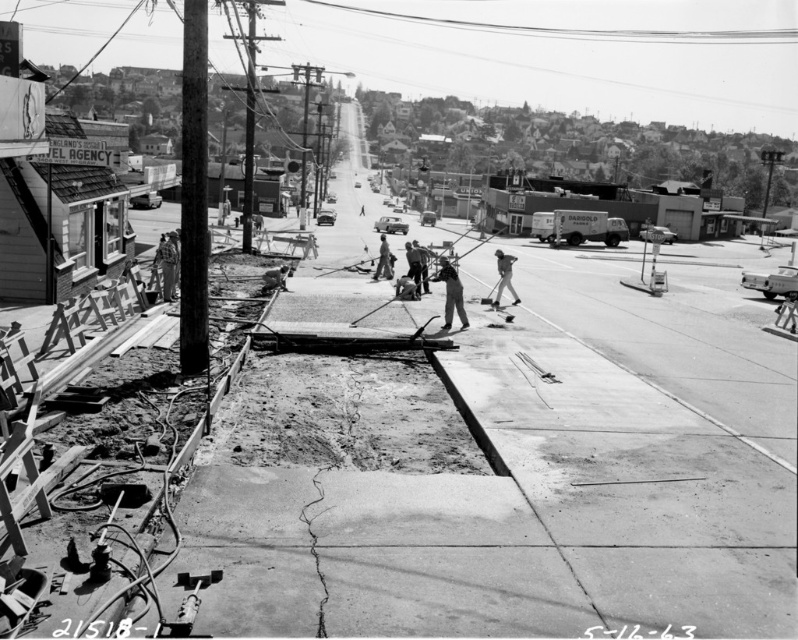
You are a photographer standing at the edge of the construction site in the scene. You want to take a photo that includes both the point at coordinates point (571, 33) and point (508, 285). Which point should you position closer to the camera to ensure both are in focus?

To ensure both points are in focus, you should position the camera closer to point (508, 285) since it is nearer to the camera than point (571, 33). This way, the depth of field will cover both points effectively.